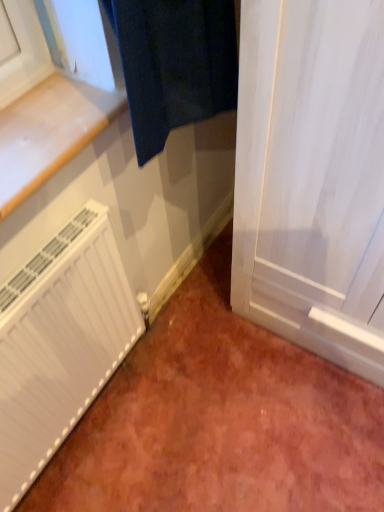
What do you see at coordinates (59, 343) in the screenshot?
I see `white matte radiator at lower left` at bounding box center [59, 343].

This screenshot has width=384, height=512. Find the location of `white matte radiator at lower left`. white matte radiator at lower left is located at coordinates (59, 343).

Where is `white matte radiator at lower left`? white matte radiator at lower left is located at coordinates (59, 343).